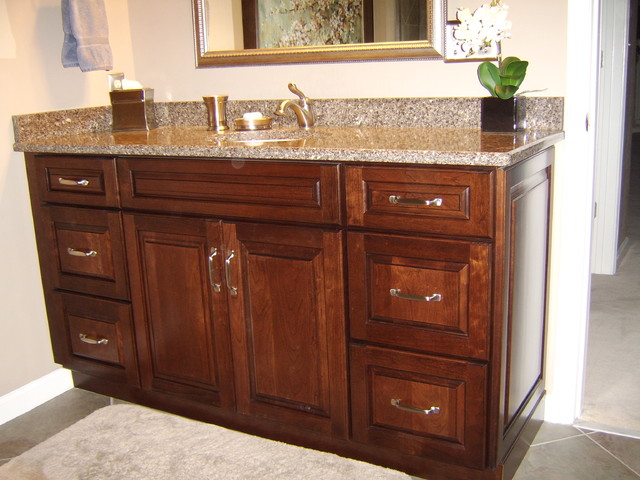
Locate an element on the screen. Image resolution: width=640 pixels, height=480 pixels. cupboard is located at coordinates (180, 283).